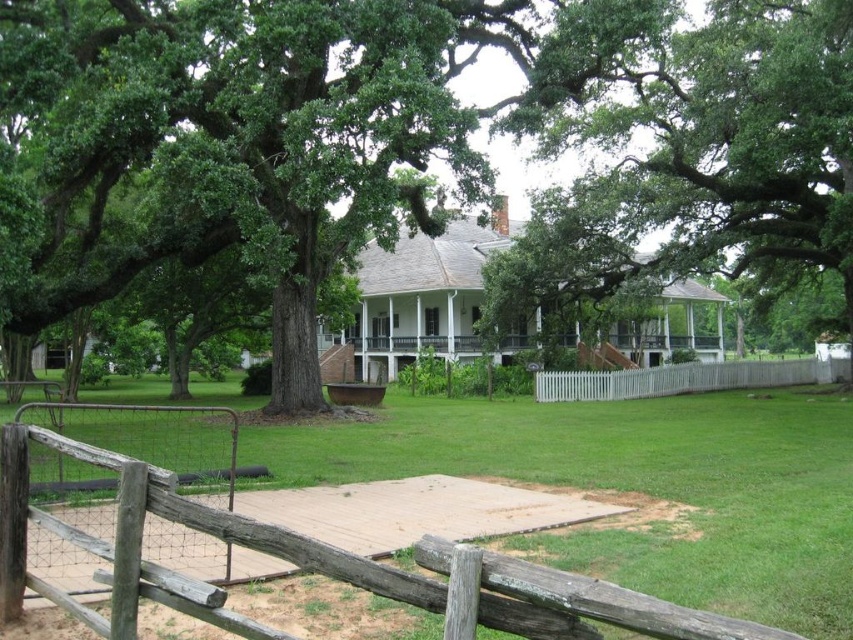
Does green leafy tree at center lie in front of green leafy tree at upper center?

Yes, green leafy tree at center is closer to the viewer.

Is green leafy tree at center to the left of green leafy tree at upper center from the viewer's perspective?

Yes, green leafy tree at center is to the left of green leafy tree at upper center.

At what (x,y) coordinates should I click in order to perform the action: click on green leafy tree at center. Please return your answer as a coordinate pair (x, y). This screenshot has height=640, width=853. Looking at the image, I should click on (418, 141).

Does point (543, 147) come closer to viewer compared to point (393, 348)?

Yes, it is.

Find the location of a particular element. This screenshot has height=640, width=853. green leafy tree at upper center is located at coordinates 701,156.

Identify the location of green leafy tree at upper center. (701, 156).

Does green leafy tree at center have a lesser width compared to white picket fence at center?

No.

Between point (479, 3) and point (817, 372), which one is positioned in front?

Point (479, 3) is more forward.

Identify the location of green leafy tree at center. The image size is (853, 640). (418, 141).